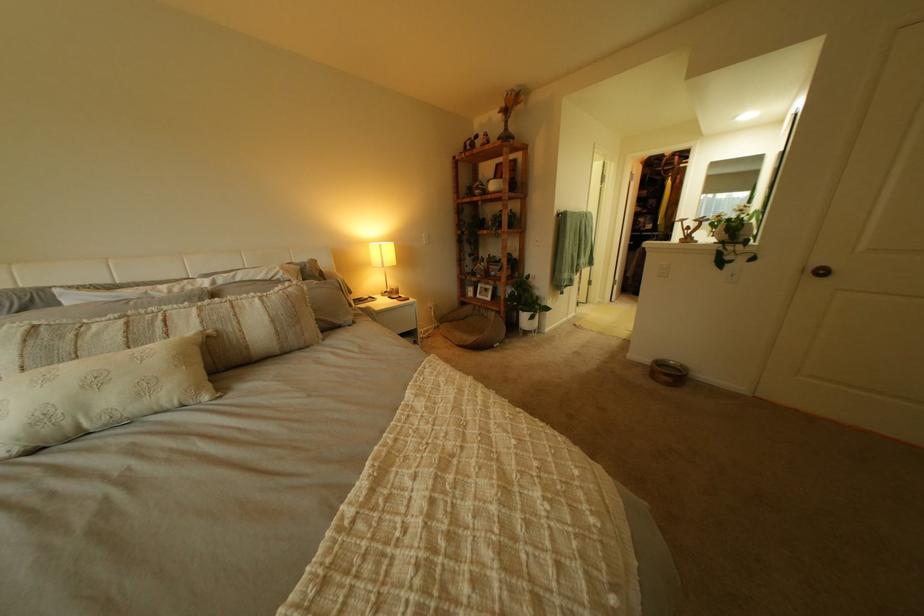
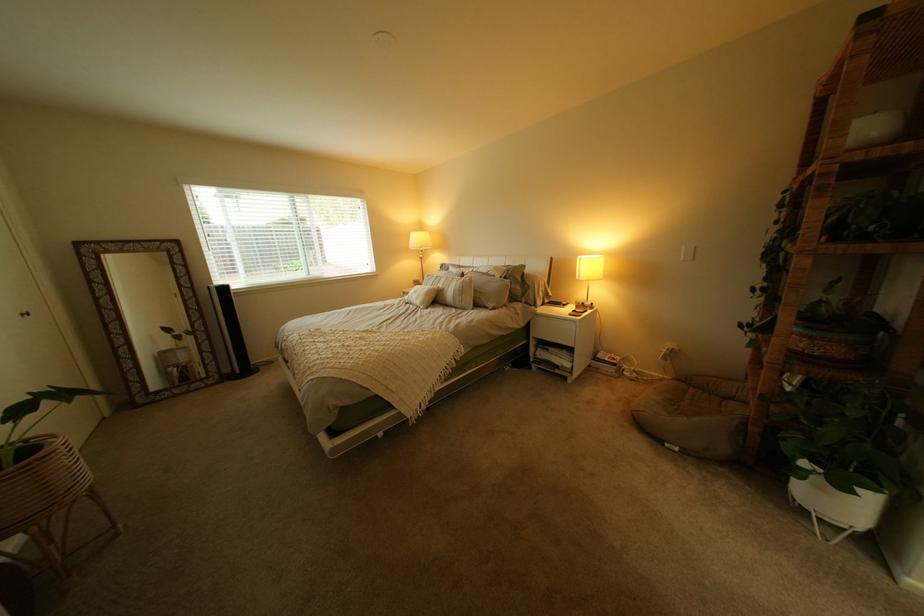
Question: I am providing you with two images of the same scene from different viewpoints. Please identify which objects are invisible in image2.

Choices:
 (A) white ceramic pot
 (B) rotary lamp switch
 (C) white plant pot
 (D) none of these

Answer: (D)